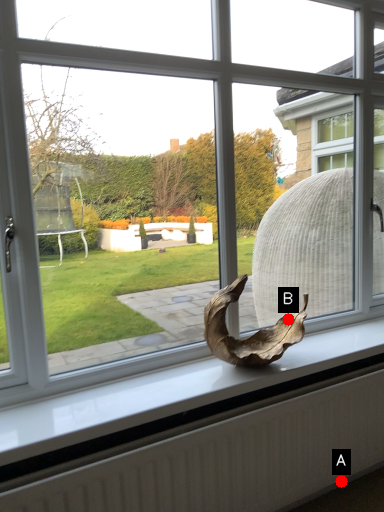
Question: Two points are circled on the image, labeled by A and B beside each circle. Among these points, which one is farthest from the camera?

Choices:
 (A) A is further
 (B) B is further

Answer: (B)